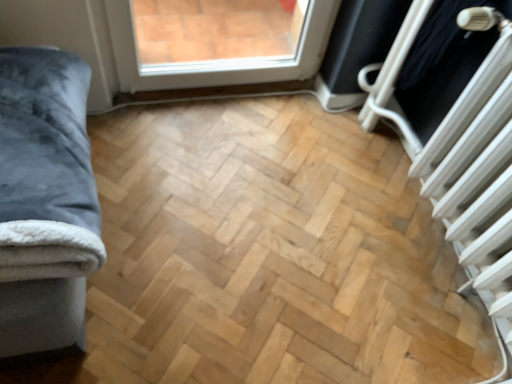
Locate an element on the screen. The width and height of the screenshot is (512, 384). vacant space in front of white metallic radiator at right is located at coordinates (417, 332).